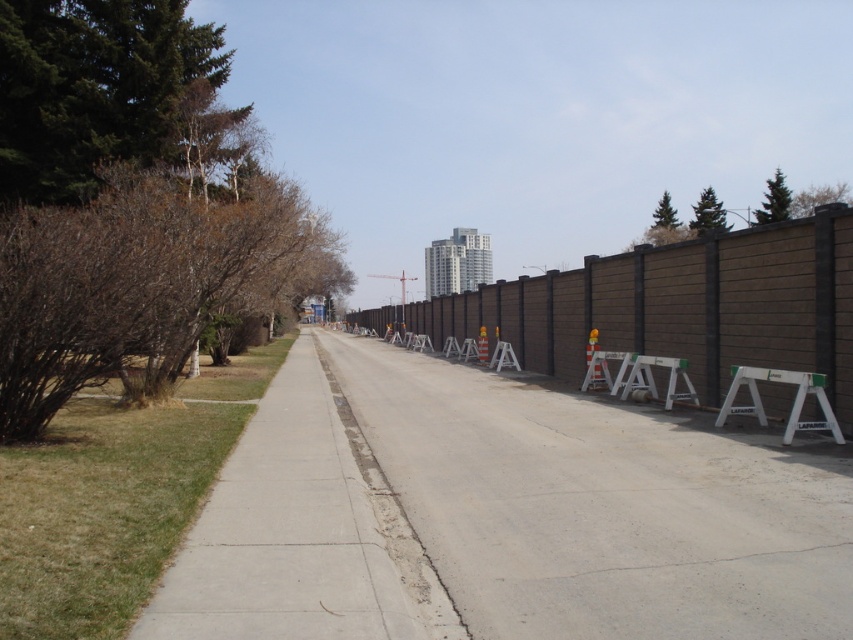
Does gray concrete pavement at center have a larger size compared to white plastic sawhorse at right?

Yes.

Who is more distant from viewer, [486,380] or [750,396]?

Positioned behind is point [486,380].

Is point (640, 515) positioned before point (821, 380)?

Yes, it is.

Where is `gray concrete pavement at center`? gray concrete pavement at center is located at coordinates (601, 508).

Is gray concrete pavement at center smaller than brown textured fence at center?

Indeed, gray concrete pavement at center has a smaller size compared to brown textured fence at center.

Based on the photo, between gray concrete pavement at center and brown textured fence at center, which one has less height?

Standing shorter between the two is gray concrete pavement at center.

Identify the location of gray concrete pavement at center. (601, 508).

Does gray concrete sidewalk at lower left have a lesser width compared to brown textured fence at center?

Yes, gray concrete sidewalk at lower left is thinner than brown textured fence at center.

Looking at this image, does gray concrete sidewalk at lower left have a larger size compared to brown textured fence at center?

No, gray concrete sidewalk at lower left is not bigger than brown textured fence at center.

This screenshot has height=640, width=853. I want to click on gray concrete sidewalk at lower left, so click(x=300, y=532).

This screenshot has height=640, width=853. Find the location of `gray concrete sidewalk at lower left`. gray concrete sidewalk at lower left is located at coordinates (300, 532).